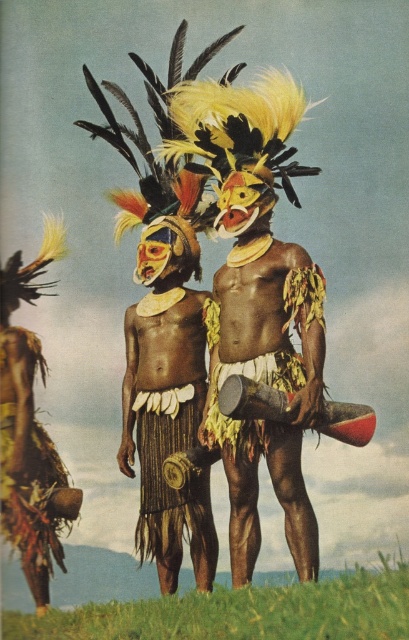
Is matte brown skin at center taller than brown woven skirt at center?

Yes.

Which is behind, point (146, 230) or point (163, 424)?

The point (146, 230) is more distant.

Is point (197, 566) positioned after point (200, 500)?

That is True.

Identify the location of matte brown skin at center. (166, 403).

Is brown woven skirt at center below brown woven basket at lower left?

No.

What do you see at coordinates (164, 481) in the screenshot?
I see `brown woven skirt at center` at bounding box center [164, 481].

You are a GUI agent. You are given a task and a screenshot of the screen. Output one action in this format:
    pyautogui.click(x=<x>, y=<y>)
    Task: Click on the brown woven skirt at center
    The width and height of the screenshot is (409, 640).
    Given the screenshot: What is the action you would take?
    pyautogui.click(x=164, y=481)

Is matte brown skin at center above brown woven basket at lower left?

Yes, matte brown skin at center is above brown woven basket at lower left.

Find the location of a particular element. matte brown skin at center is located at coordinates (166, 403).